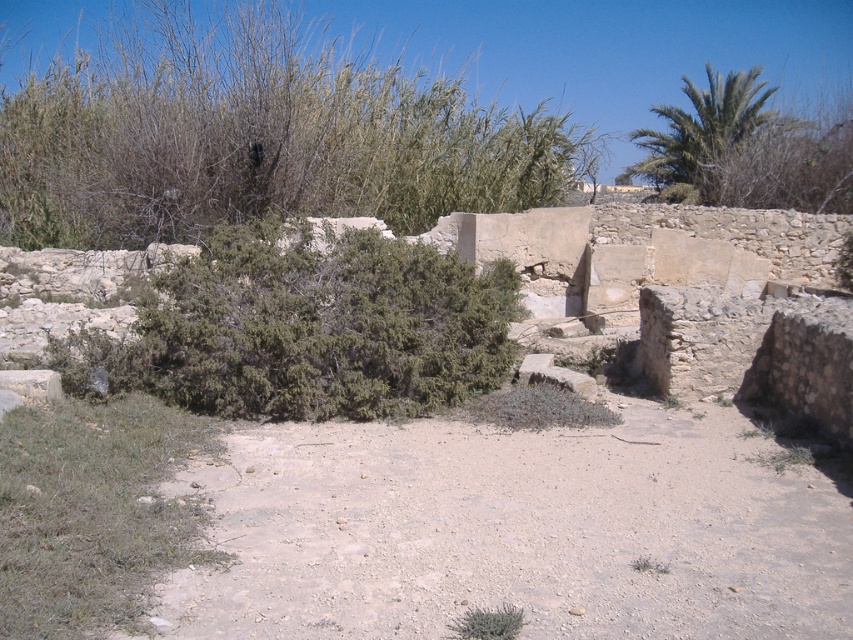
You are a botanist studying plant growth in arid environments. You observe the green leafy bush at upper left and the green leafy bush at lower center in this desert scene. Which of these two bushes has a greater width?

The green leafy bush at upper left has a greater width compared to the green leafy bush at lower center.

You are an archaeologist examining the ruins and notice two plants in the scene. Which one is closer to you between the green shrub at center and the green leafy bush at lower center?

The green shrub at center is closer to you because the green leafy bush at lower center is positioned behind it.